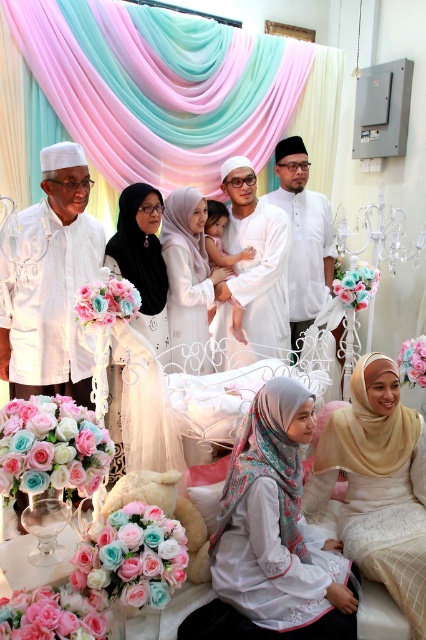
Is point (261, 284) closer to viewer compared to point (198, 307)?

That is False.

Does white matte/soft fabric at center appear on the left side of matte white hijab at center?

Incorrect, white matte/soft fabric at center is not on the left side of matte white hijab at center.

Is point (238, 188) positioned after point (204, 244)?

Yes, point (238, 188) is behind point (204, 244).

You are a GUI agent. You are given a task and a screenshot of the screen. Output one action in this format:
    pyautogui.click(x=<x>, y=<y>)
    Task: Click on the white matte/soft fabric at center
    
    Given the screenshot: What is the action you would take?
    pyautogui.click(x=253, y=273)

Can you confirm if white matte shirt at left is thinner than white matte/soft fabric at center?

In fact, white matte shirt at left might be wider than white matte/soft fabric at center.

Does white matte shirt at left appear on the right side of white matte/soft fabric at center?

In fact, white matte shirt at left is to the left of white matte/soft fabric at center.

Locate an element on the screen. white matte shirt at left is located at coordinates (52, 284).

Does beige satin hijab at lower right have a smaller size compared to white satin dress at center?

No.

I want to click on beige satin hijab at lower right, so click(x=377, y=484).